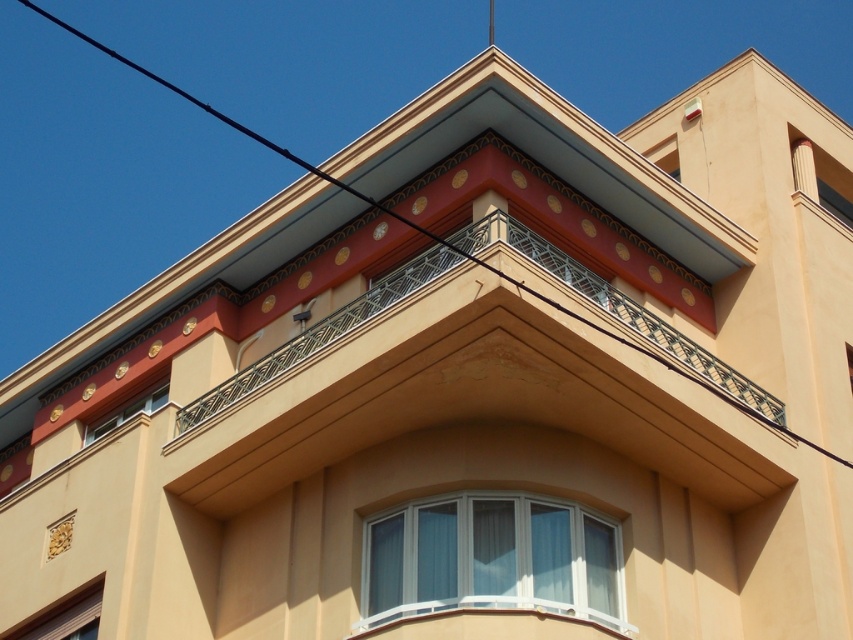
Does matte beige window at lower left have a greater width compared to matte gold window at upper left?

Yes.

Is matte beige window at lower left below matte gold window at upper left?

Indeed, matte beige window at lower left is positioned under matte gold window at upper left.

Does point (59, 637) come in front of point (126, 408)?

Yes.

What are the coordinates of `matte beige window at lower left` in the screenshot? It's located at (67, 616).

Which is more to the left, white plastic window at center or matte gold window at upper left?

Positioned to the left is matte gold window at upper left.

Is white plastic window at center further to camera compared to matte gold window at upper left?

That is False.

Who is more forward, (399, 538) or (155, 404)?

Point (399, 538) is more forward.

Locate an element on the screen. This screenshot has height=640, width=853. white plastic window at center is located at coordinates (491, 560).

Can you confirm if white plastic window at center is wider than matte beige window at lower left?

Correct, the width of white plastic window at center exceeds that of matte beige window at lower left.

Between white plastic window at center and matte beige window at lower left, which one appears on the left side from the viewer's perspective?

matte beige window at lower left is more to the left.

Does point (450, 520) come farther from viewer compared to point (39, 621)?

No, it is not.

Where is `white plastic window at center`? This screenshot has width=853, height=640. white plastic window at center is located at coordinates (491, 560).